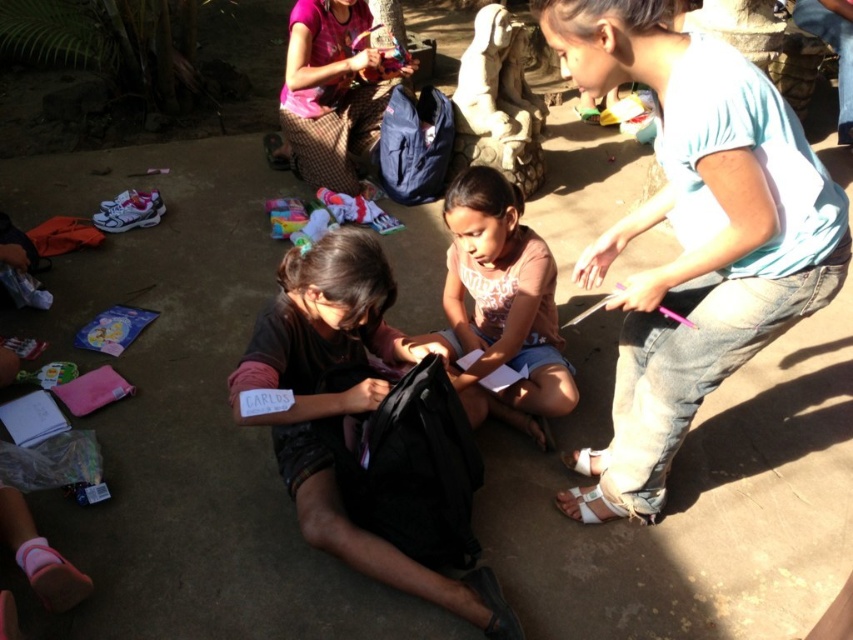
Can you confirm if blue jeans at lower right is positioned to the left of pink fabric at center?

In fact, blue jeans at lower right is to the right of pink fabric at center.

What do you see at coordinates (695, 236) in the screenshot?
I see `blue jeans at lower right` at bounding box center [695, 236].

Does point (706, 168) come farther from viewer compared to point (537, 275)?

No.

Find the location of `blue jeans at lower right`. blue jeans at lower right is located at coordinates (695, 236).

Is point (456, 282) farther from viewer compared to point (349, 182)?

No, (456, 282) is closer to viewer.

Between point (502, 212) and point (299, 42), which one is positioned behind?

The point (299, 42) is more distant.

Between point (445, 280) and point (364, 134), which one is positioned behind?

Point (364, 134)

Image resolution: width=853 pixels, height=640 pixels. I want to click on pink fabric at center, so click(503, 301).

Who is taller, blue jeans at lower right or pink fabric at upper center?

With more height is blue jeans at lower right.

Can you confirm if blue jeans at lower right is positioned above pink fabric at upper center?

No.

Is point (712, 228) less distant than point (347, 92)?

Yes, point (712, 228) is in front of point (347, 92).

Image resolution: width=853 pixels, height=640 pixels. In order to click on blue jeans at lower right in this screenshot , I will do `click(695, 236)`.